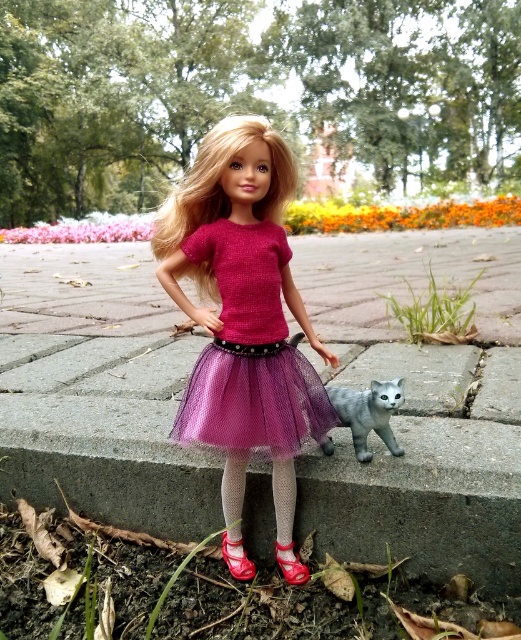
You are a photographer standing 1.5 meters away from the purple tulle dress at center. You want to take a closeup shot of the dress using a camera that has a minimum focusing distance of 1.2 meters. Can you take the photo without moving closer?

The purple tulle dress at center and camera are 1.04 meters apart. Since the minimum focusing distance is 1.2 meters, the camera cannot focus because the distance is shorter than required. You need to move back to at least 1.2 meters away.

You are a fashion designer observing the doll in the park. You notice the matte pink tulle skirt at center and the purple tulle dress at center. Which garment is positioned higher on the doll?

The matte pink tulle skirt at center is above the purple tulle dress at center, so the matte pink tulle skirt at center is positioned higher on the doll.